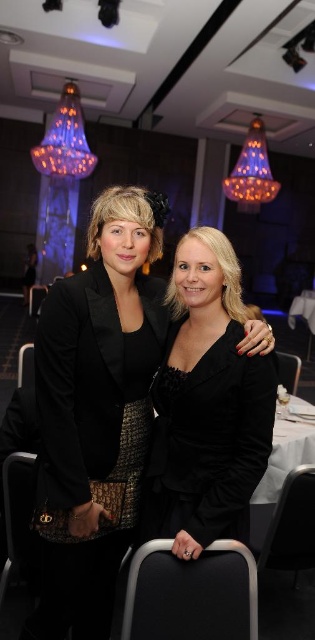
Can you confirm if black textured blazer at center is positioned below black velvet jacket at center?

Yes.

Can you confirm if black textured blazer at center is positioned to the left of black velvet jacket at center?

Yes, black textured blazer at center is to the left of black velvet jacket at center.

Who is more distant from viewer, (49, 602) or (148, 538)?

Positioned behind is point (148, 538).

You are a GUI agent. You are given a task and a screenshot of the screen. Output one action in this format:
    pyautogui.click(x=<x>, y=<y>)
    Task: Click on the black textured blazer at center
    
    Given the screenshot: What is the action you would take?
    pyautogui.click(x=90, y=442)

Is black velvet dress at center above black textured blazer at center?

Yes, black velvet dress at center is above black textured blazer at center.

Is black velvet dress at center taller than black textured blazer at center?

Correct, black velvet dress at center is much taller as black textured blazer at center.

Between point (137, 227) and point (113, 429), which one is positioned in front?

Positioned in front is point (113, 429).

Locate an element on the screen. black velvet dress at center is located at coordinates [96, 412].

Does black velvet dress at center have a larger size compared to black velvet jacket at center?

Indeed, black velvet dress at center has a larger size compared to black velvet jacket at center.

Is black velvet dress at center thinner than black velvet jacket at center?

No.

Measure the distance between point (68, 362) and camera.

Point (68, 362) and camera are 1.45 meters apart.

Find the location of a particular element. The image size is (315, 640). black velvet dress at center is located at coordinates (96, 412).